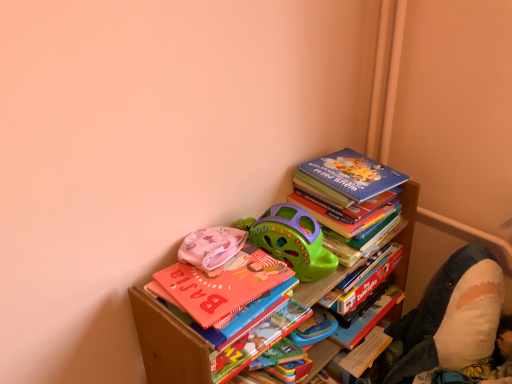
I want to click on vacant space in front of pink fabric at upper left, which is the third toy in right-to-left order, so click(204, 294).